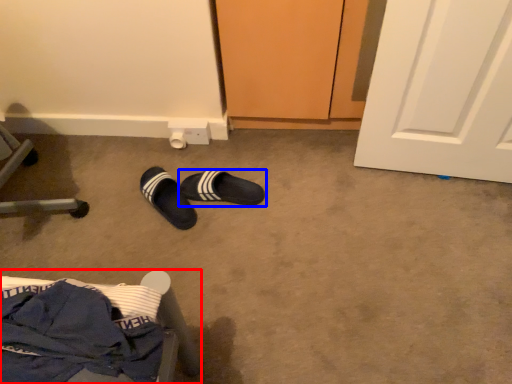
Question: Which object appears farthest to the camera in this image, furniture (highlighted by a red box) or footwear (highlighted by a blue box)?

Choices:
 (A) furniture
 (B) footwear

Answer: (B)